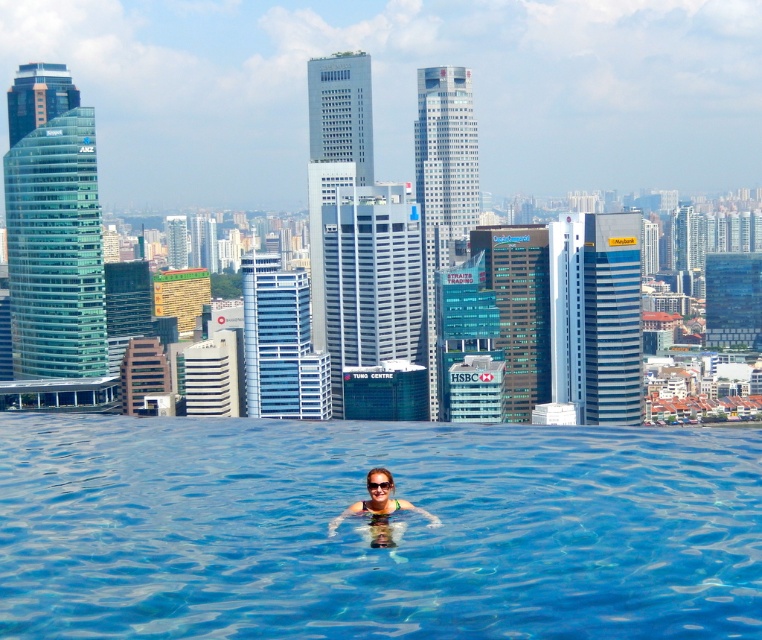
Question: Is matte black swimsuit at center bigger than transparent plastic goggles at center?

Choices:
 (A) yes
 (B) no

Answer: (A)

Question: Which object is the farthest from the transparent plastic goggles at center?

Choices:
 (A) transparent blue water at center
 (B) matte black swimsuit at center

Answer: (A)

Question: Can you confirm if transparent blue water at center is thinner than matte black swimsuit at center?

Choices:
 (A) yes
 (B) no

Answer: (B)

Question: Can you confirm if transparent blue water at center is wider than transparent plastic goggles at center?

Choices:
 (A) no
 (B) yes

Answer: (B)

Question: Which is farther from the matte black swimsuit at center?

Choices:
 (A) transparent plastic goggles at center
 (B) transparent blue water at center

Answer: (B)

Question: Which of the following is the farthest from the observer?

Choices:
 (A) transparent blue water at center
 (B) transparent plastic goggles at center
 (C) matte black swimsuit at center

Answer: (B)